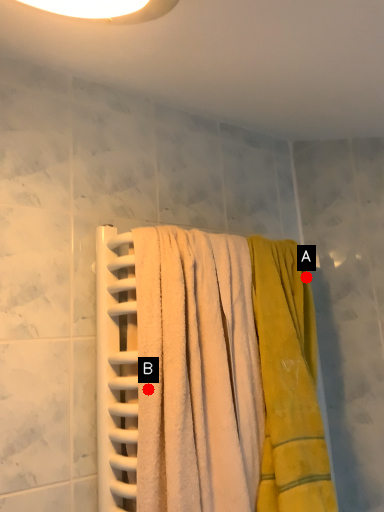
Question: Two points are circled on the image, labeled by A and B beside each circle. Which of the following is the closest to the observer?

Choices:
 (A) A is closer
 (B) B is closer

Answer: (B)